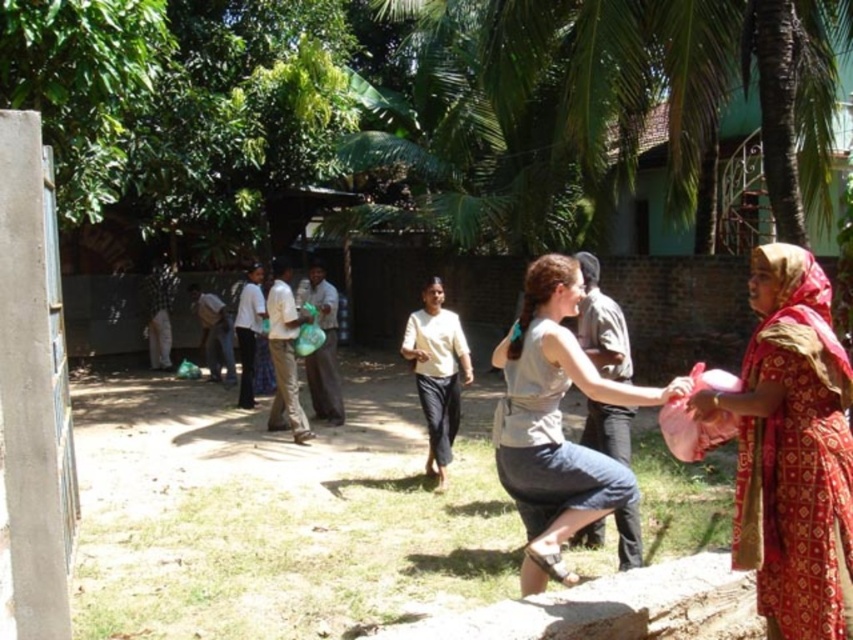
Does point (821, 321) come closer to viewer compared to point (598, 380)?

Yes, point (821, 321) is in front of point (598, 380).

Does point (824, 392) come farther from viewer compared to point (527, 493)?

No, it is not.

Is point (757, 282) positioned behind point (566, 260)?

No, (757, 282) is in front of (566, 260).

The height and width of the screenshot is (640, 853). What are the coordinates of `red printed sari at right` in the screenshot? It's located at (792, 451).